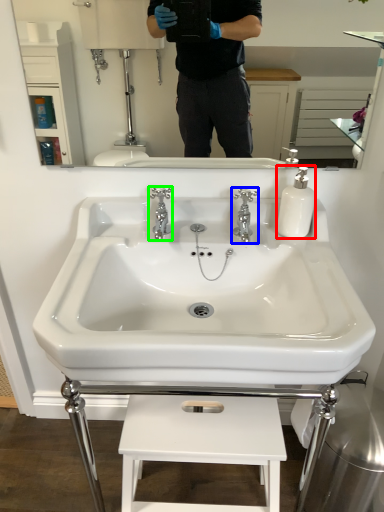
Question: Considering the real-world distances, which object is farthest from soap dispenser (highlighted by a red box)? tap (highlighted by a blue box) or tap (highlighted by a green box)?

Choices:
 (A) tap
 (B) tap

Answer: (B)